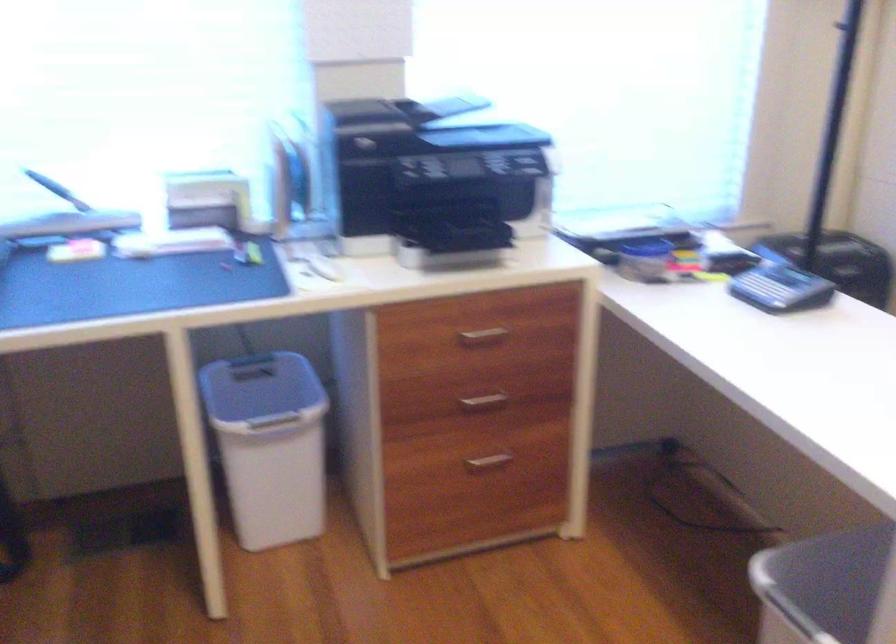
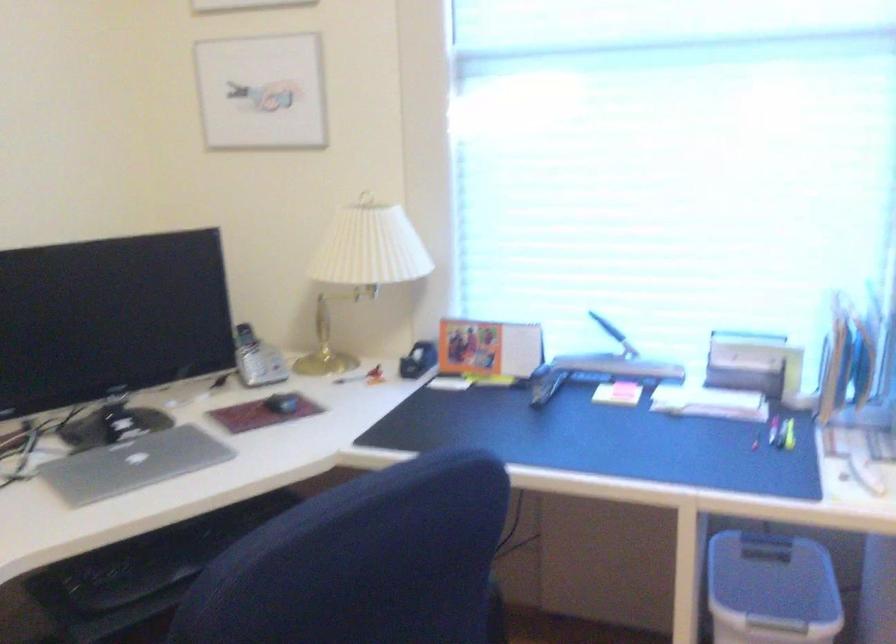
Where in the second image is the point corresponding to pixel 263 404 from the first image?

(771, 589)